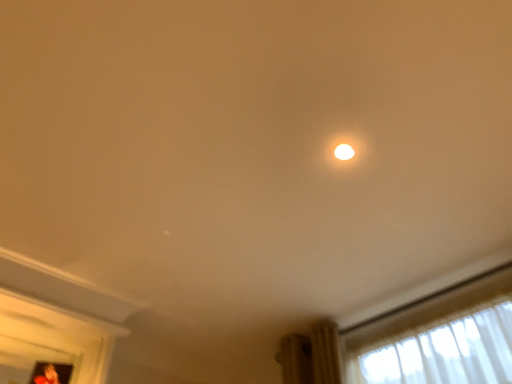
Describe the element at coordinates (344, 150) in the screenshot. I see `white glossy light at center` at that location.

Find the location of a particular element. This screenshot has height=384, width=512. white glossy light at center is located at coordinates (344, 150).

Locate an element on the screen. The height and width of the screenshot is (384, 512). white glossy light at center is located at coordinates (344, 150).